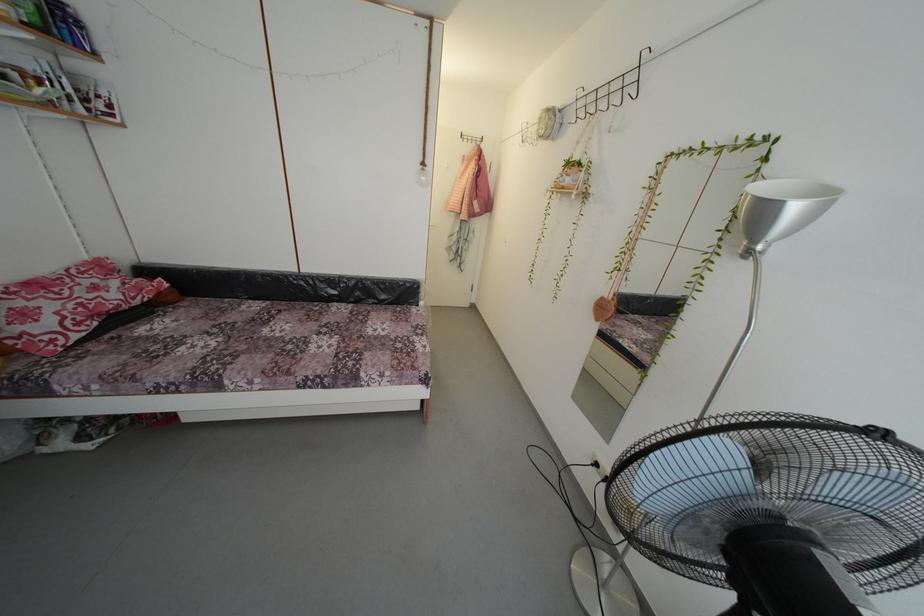
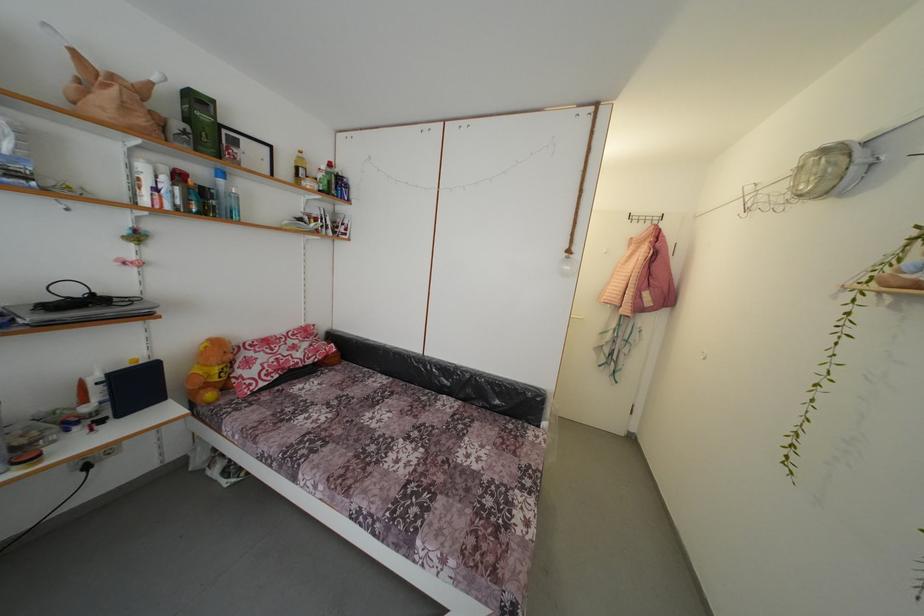
Question: The images are taken continuously from a first-person perspective. In which direction is your viewpoint rotating?

Choices:
 (A) Left
 (B) Right
 (C) Up
 (D) Down

Answer: (A)